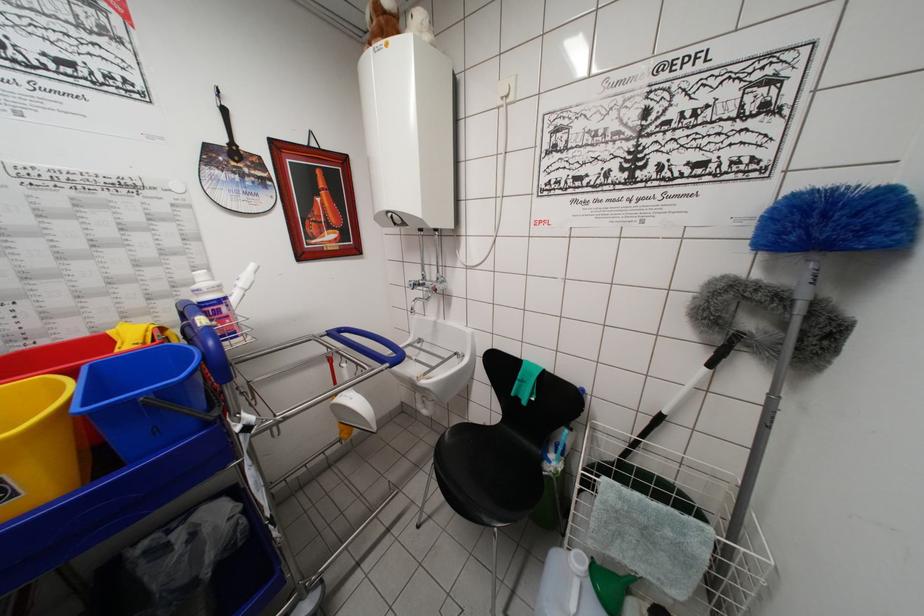
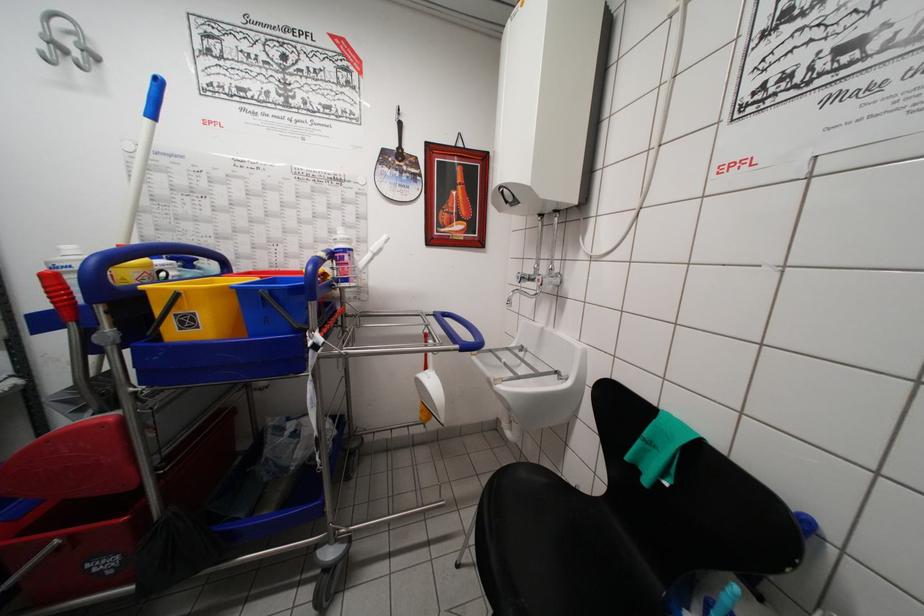
Locate, in the second image, the point that corresponds to the point at 492,429 in the first image.

(592, 499)